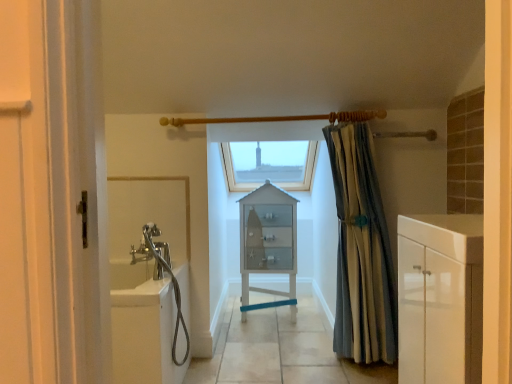
Question: From a real-world perspective, does transparent glass window at center stand above striped fabric curtain at right?

Choices:
 (A) no
 (B) yes

Answer: (B)

Question: Considering the relative positions of transparent glass window at center and striped fabric curtain at right in the image provided, is transparent glass window at center in front of striped fabric curtain at right?

Choices:
 (A) no
 (B) yes

Answer: (A)

Question: From a real-world perspective, is transparent glass window at center located beneath striped fabric curtain at right?

Choices:
 (A) yes
 (B) no

Answer: (B)

Question: Is transparent glass window at center behind striped fabric curtain at right?

Choices:
 (A) no
 (B) yes

Answer: (B)

Question: Are transparent glass window at center and striped fabric curtain at right beside each other?

Choices:
 (A) yes
 (B) no

Answer: (B)

Question: Is there a large distance between transparent glass window at center and striped fabric curtain at right?

Choices:
 (A) yes
 (B) no

Answer: (A)

Question: Is transparent glass window at center completely or partially inside white glossy cabinet at right?

Choices:
 (A) yes
 (B) no

Answer: (B)

Question: Does white glossy cabinet at right turn towards transparent glass window at center?

Choices:
 (A) no
 (B) yes

Answer: (A)

Question: From a real-world perspective, is white glossy cabinet at right positioned over transparent glass window at center based on gravity?

Choices:
 (A) no
 (B) yes

Answer: (A)

Question: From the image's perspective, does white glossy cabinet at right appear higher than transparent glass window at center?

Choices:
 (A) no
 (B) yes

Answer: (A)

Question: Is white glossy cabinet at right facing away from transparent glass window at center?

Choices:
 (A) no
 (B) yes

Answer: (A)

Question: Can you confirm if white glossy cabinet at right is bigger than transparent glass window at center?

Choices:
 (A) yes
 (B) no

Answer: (B)

Question: Considering the relative sizes of white glass cabinet at center and white glossy bathtub at left in the image provided, is white glass cabinet at center thinner than white glossy bathtub at left?

Choices:
 (A) no
 (B) yes

Answer: (A)